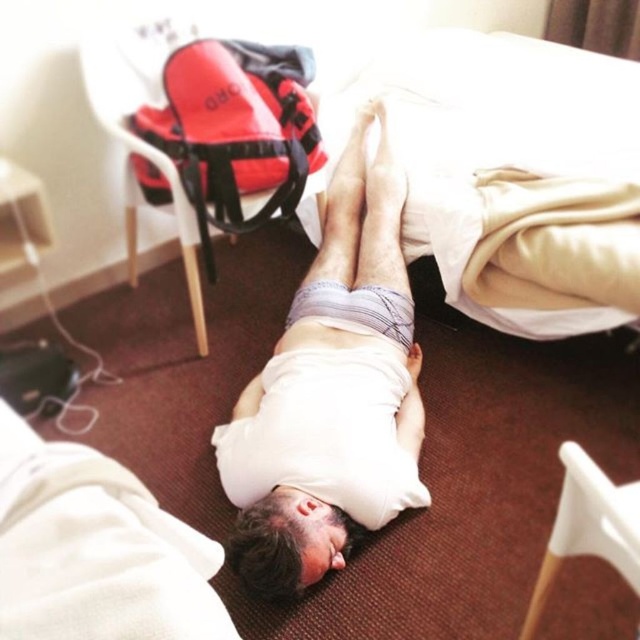
Question: Observing the image, what is the correct spatial positioning of white soft bed at upper center in reference to white cotton shirt at center?

Choices:
 (A) right
 (B) left

Answer: (A)

Question: Among these objects, which one is farthest from the camera?

Choices:
 (A) white soft bed at upper center
 (B) white cotton shirt at center

Answer: (A)

Question: Which point is closer to the camera taking this photo?

Choices:
 (A) click(x=401, y=269)
 (B) click(x=436, y=188)

Answer: (A)

Question: Does white soft bed at upper center appear under white cotton shirt at center?

Choices:
 (A) no
 (B) yes

Answer: (A)

Question: Where is white soft bed at upper center located in relation to white cotton shirt at center in the image?

Choices:
 (A) below
 (B) above

Answer: (B)